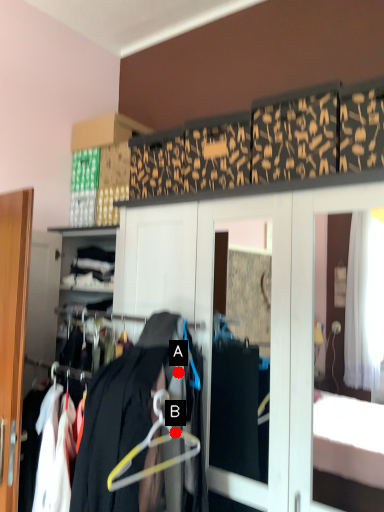
Question: Two points are circled on the image, labeled by A and B beside each circle. Among these points, which one is nearest to the camera?

Choices:
 (A) A is closer
 (B) B is closer

Answer: (B)